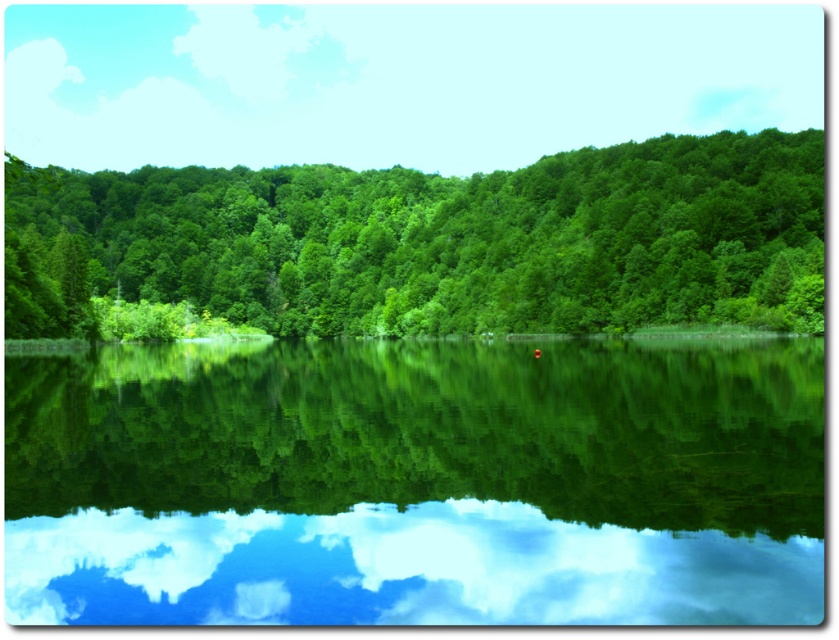
Question: Which of the following is the closest to the observer?

Choices:
 (A) green leafy trees at center
 (B) green reflective water at center

Answer: (B)

Question: Does green reflective water at center have a greater width compared to green leafy trees at center?

Choices:
 (A) no
 (B) yes

Answer: (A)

Question: Is green reflective water at center bigger than green leafy trees at center?

Choices:
 (A) no
 (B) yes

Answer: (A)

Question: Among these points, which one is farthest from the camera?

Choices:
 (A) click(610, 227)
 (B) click(628, 600)

Answer: (A)

Question: Which object is farther from the camera taking this photo?

Choices:
 (A) green reflective water at center
 (B) green leafy trees at center

Answer: (B)

Question: Is green reflective water at center positioned behind green leafy trees at center?

Choices:
 (A) no
 (B) yes

Answer: (A)